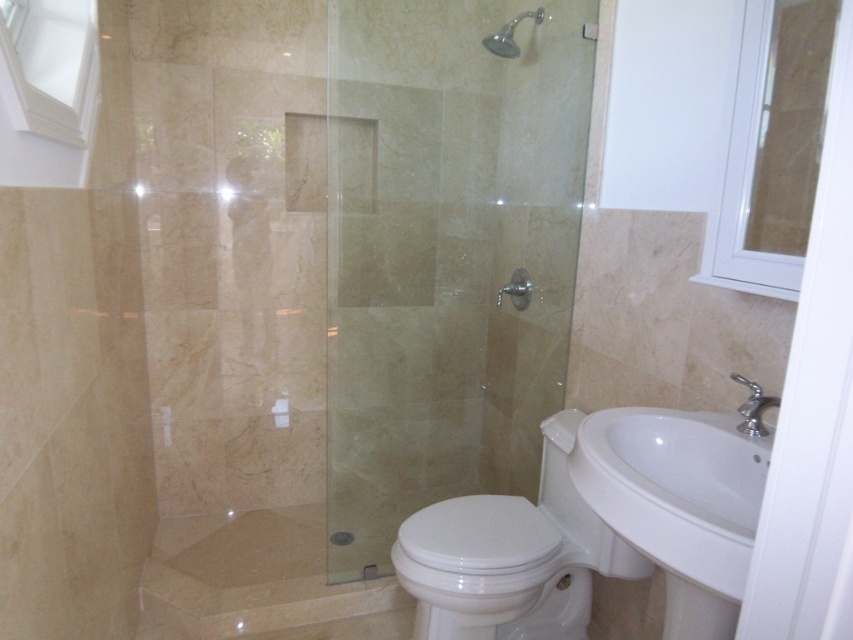
You are standing in the bathroom and need to place a small plant between the white glossy sink at lower right and the white glossy toilet at lower center. Based on their positions, where should you place the plant?

You should place the plant to the right of the white glossy toilet at lower center since the white glossy sink at lower right is located to its right, creating space between them.

You are standing in the bathroom and want to locate the clear glass shower door at center. According to the coordinate system where the bottom left corner is the origin, can you tell me its position?

The clear glass shower door at center is located at coordinate point (445,253).

You are standing in the bathroom and want to exit through the door. Where should you walk towards to reach the white glossy screen door at right?

The white glossy screen door at right is located at point 0.647 on the x axis and 0.955 on the y axis, so you should walk towards the lower right corner of the bathroom to reach it.